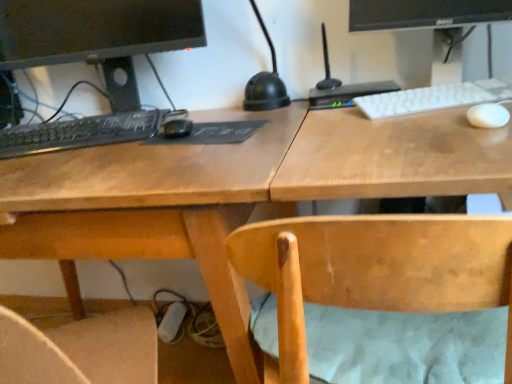
Question: Does black matte keyboard at left, the 2th computer keyboard in the right-to-left sequence, have a lesser height compared to wooden desk at center?

Choices:
 (A) no
 (B) yes

Answer: (B)

Question: Considering the relative sizes of black matte keyboard at left, the 2th computer keyboard in the right-to-left sequence, and wooden desk at center in the image provided, is black matte keyboard at left, the 2th computer keyboard in the right-to-left sequence, bigger than wooden desk at center?

Choices:
 (A) yes
 (B) no

Answer: (B)

Question: Could wooden desk at center be considered to be inside black matte keyboard at left, the 2th computer keyboard in the right-to-left sequence?

Choices:
 (A) yes
 (B) no

Answer: (B)

Question: From a real-world perspective, is black matte keyboard at left, the 2th computer keyboard in the right-to-left sequence, beneath wooden desk at center?

Choices:
 (A) yes
 (B) no

Answer: (B)

Question: Does black matte keyboard at left, positioned as the first computer keyboard in left-to-right order, have a greater width compared to wooden desk at center?

Choices:
 (A) yes
 (B) no

Answer: (B)

Question: From the image's perspective, is black glossy monitor at upper right positioned above or below white matte keyboard at upper right, the 1th computer keyboard in the right-to-left sequence?

Choices:
 (A) above
 (B) below

Answer: (A)

Question: From their relative heights in the image, would you say black glossy monitor at upper right is taller or shorter than white matte keyboard at upper right, the second computer keyboard in the left-to-right sequence?

Choices:
 (A) tall
 (B) short

Answer: (A)

Question: Considering their positions, is black glossy monitor at upper right located in front of or behind white matte keyboard at upper right, the second computer keyboard in the left-to-right sequence?

Choices:
 (A) front
 (B) behind

Answer: (A)

Question: Visually, is black glossy monitor at upper right positioned to the left or to the right of white matte keyboard at upper right, the 1th computer keyboard in the right-to-left sequence?

Choices:
 (A) left
 (B) right

Answer: (A)

Question: Is light brown wood chair at center to the left or to the right of black matte keyboard at left, which appears as the 1th computer when viewed from the left, in the image?

Choices:
 (A) left
 (B) right

Answer: (B)

Question: Considering their positions, is light brown wood chair at center located in front of or behind black matte keyboard at left, which is the 2th computer in right-to-left order?

Choices:
 (A) behind
 (B) front

Answer: (B)

Question: In terms of size, does light brown wood chair at center appear bigger or smaller than black matte keyboard at left, which is the 2th computer in right-to-left order?

Choices:
 (A) big
 (B) small

Answer: (A)

Question: Is point (309, 216) positioned closer to the camera than point (140, 132)?

Choices:
 (A) farther
 (B) closer

Answer: (B)

Question: Is black matte keyboard at left, which is the 2th computer in right-to-left order, inside the boundaries of white matte keyboard at upper right, the 1th computer keyboard in the right-to-left sequence, or outside?

Choices:
 (A) outside
 (B) inside

Answer: (A)

Question: Looking at their shapes, would you say black matte keyboard at left, which is the 2th computer in right-to-left order, is wider or thinner than white matte keyboard at upper right, the second computer keyboard in the left-to-right sequence?

Choices:
 (A) thin
 (B) wide

Answer: (B)